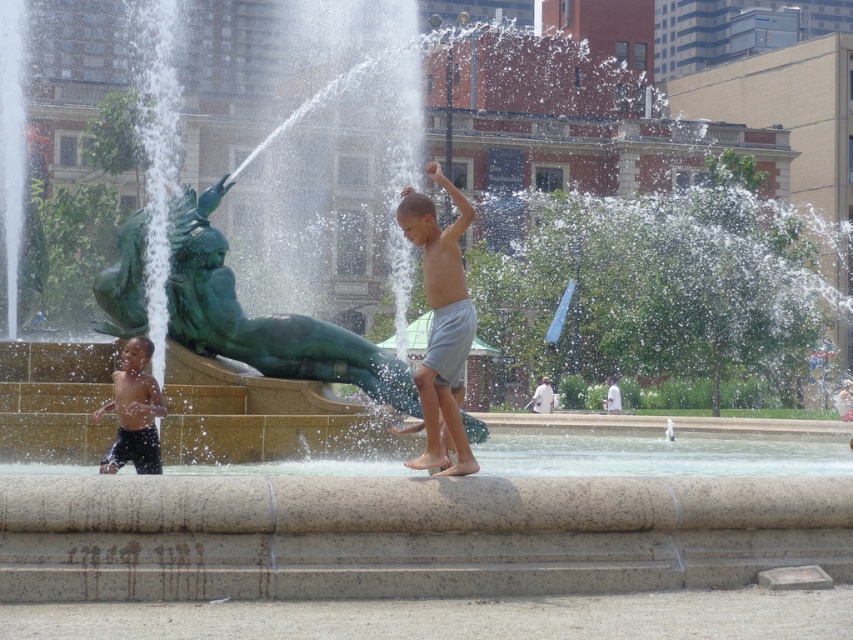
Question: Which object is closer to the camera taking this photo?

Choices:
 (A) matte black shorts at lower left
 (B) gray cotton shorts at center

Answer: (B)

Question: Which point is closer to the camera?

Choices:
 (A) (432, 346)
 (B) (115, 442)

Answer: (A)

Question: Can you confirm if gray cotton shorts at center is bigger than matte black shorts at lower left?

Choices:
 (A) no
 (B) yes

Answer: (B)

Question: Where is gray cotton shorts at center located in relation to matte black shorts at lower left in the image?

Choices:
 (A) above
 (B) below

Answer: (A)

Question: Where is gray cotton shorts at center located in relation to matte black shorts at lower left in the image?

Choices:
 (A) below
 (B) above

Answer: (B)